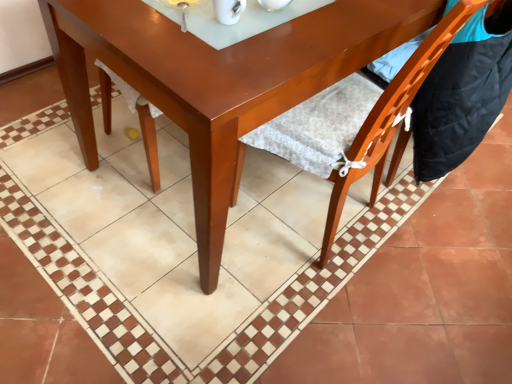
The height and width of the screenshot is (384, 512). What are the coordinates of `free space in front of glossy wood table at center` in the screenshot? It's located at (257, 307).